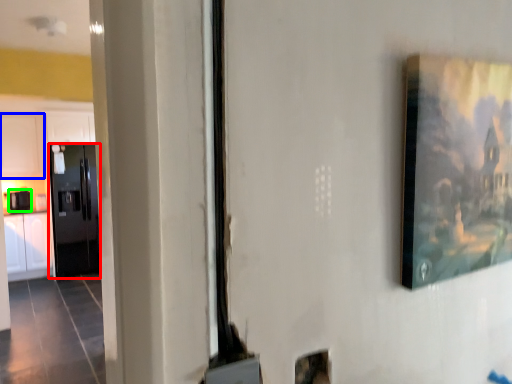
Question: Estimate the real-world distances between objects in this image. Which object is farther from door (highlighted by a red box), cabinetry (highlighted by a blue box) or appliance (highlighted by a green box)?

Choices:
 (A) cabinetry
 (B) appliance

Answer: (B)